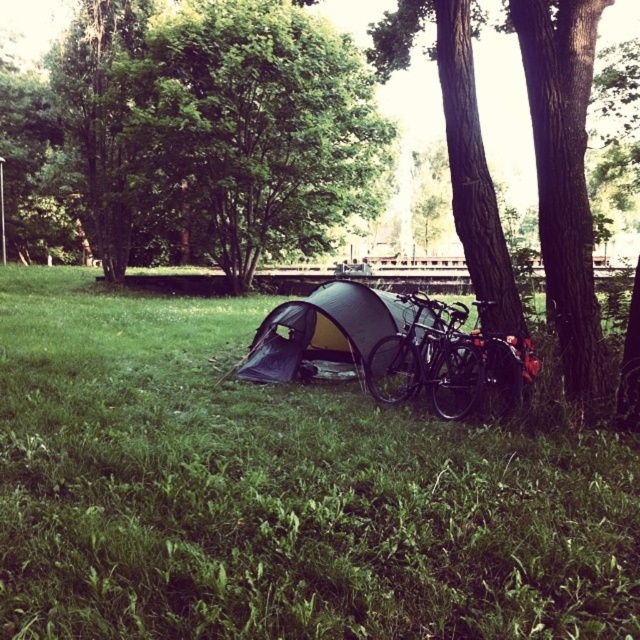
How distant is green grass at lower center from green leafy tree at upper center?

green grass at lower center and green leafy tree at upper center are 7.66 meters apart from each other.

Between point (13, 577) and point (186, 168), which one is positioned in front?

Point (13, 577) is more forward.

Find the location of `green grass at lower center`. green grass at lower center is located at coordinates (278, 493).

From the picture: Measure the distance between green grass at lower center and green fabric tent at center.

They are 7.92 feet apart.

Does point (86, 314) come behind point (397, 301)?

Yes, it is.

Identify the location of green grass at lower center. (278, 493).

Is green grass at lower center positioned in front of shiny black bicycle at right?

That is True.

Does green grass at lower center lie behind shiny black bicycle at right?

No.

Between point (189, 604) and point (467, 356), which one is positioned behind?

Point (467, 356)

Identify the location of green grass at lower center. (278, 493).